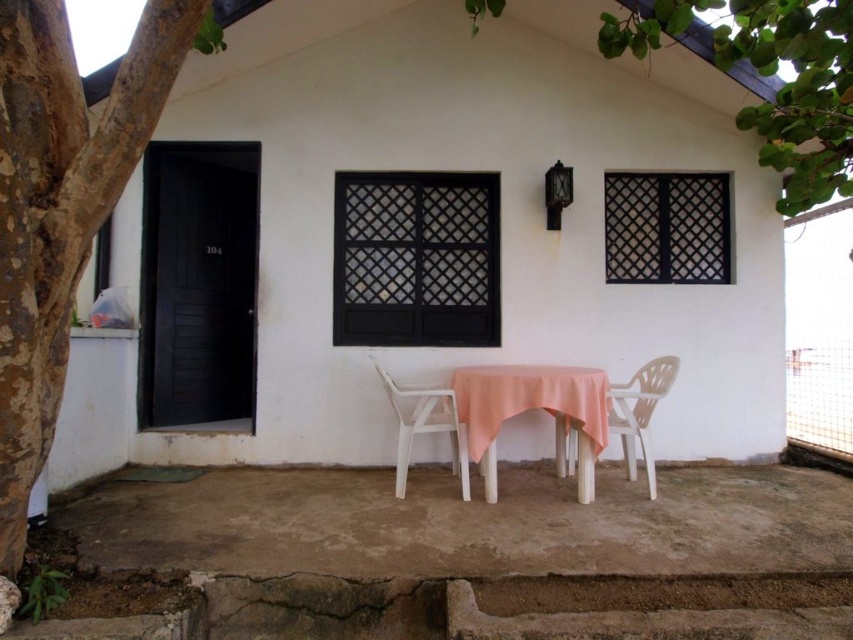
Question: Which of these objects is positioned farthest from the white plastic chair at center?

Choices:
 (A) pink fabric-covered table at center
 (B) white plastic chair at lower right
 (C) green leafy tree at upper center

Answer: (C)

Question: Estimate the real-world distances between objects in this image. Which object is closer to the white plastic chair at center?

Choices:
 (A) green leafy tree at upper center
 (B) white plastic chair at lower right

Answer: (B)

Question: Among these objects, which one is nearest to the camera?

Choices:
 (A) pink fabric-covered table at center
 (B) white plastic chair at center
 (C) green leafy tree at upper center

Answer: (C)

Question: Is green leafy tree at upper center to the right of pink fabric-covered table at center from the viewer's perspective?

Choices:
 (A) yes
 (B) no

Answer: (A)

Question: Does pink fabric-covered table at center come behind white plastic chair at lower right?

Choices:
 (A) no
 (B) yes

Answer: (A)

Question: Does smooth brown bark at left appear on the right side of white plastic chair at lower right?

Choices:
 (A) no
 (B) yes

Answer: (A)